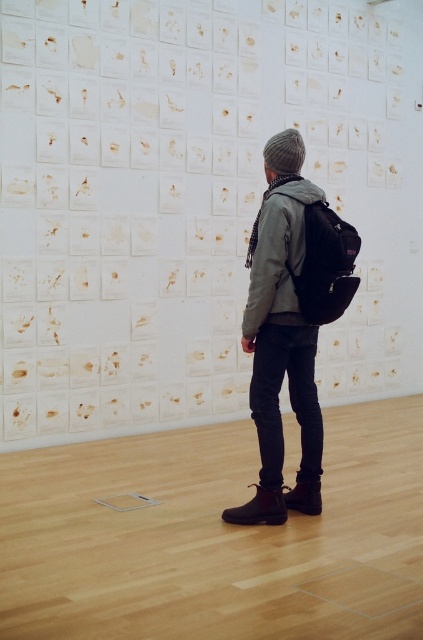
Can you confirm if matte gray jacket at center is bigger than matte black backpack at center?

Yes.

Is matte gray jacket at center below matte black backpack at center?

Correct, matte gray jacket at center is located below matte black backpack at center.

Which is behind, point (315, 189) or point (340, 266)?

The point (315, 189) is more distant.

Locate an element on the screen. matte gray jacket at center is located at coordinates (279, 256).

Who is positioned more to the left, matte paper wall at center or matte black backpack at center?

matte paper wall at center

Is point (279, 24) behind point (351, 237)?

Yes, it is behind point (351, 237).

This screenshot has width=423, height=640. I want to click on matte paper wall at center, so click(192, 202).

Looking at this image, can you confirm if matte paper wall at center is positioned below matte gray jacket at center?

Incorrect, matte paper wall at center is not positioned below matte gray jacket at center.

Which of these two, matte paper wall at center or matte gray jacket at center, stands shorter?

Standing shorter between the two is matte gray jacket at center.

Identify the location of matte paper wall at center. This screenshot has height=640, width=423. (192, 202).